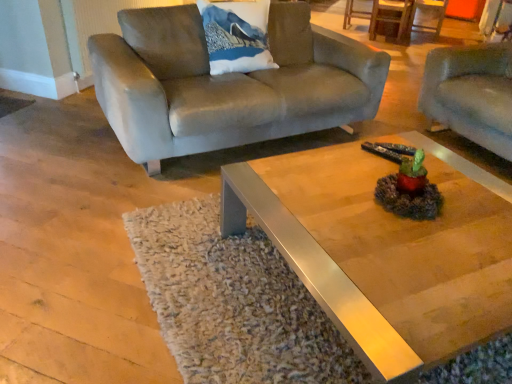
This screenshot has width=512, height=384. What are the coordinates of `vacant space to the left of metallic polished coffee table at center` in the screenshot? It's located at (81, 235).